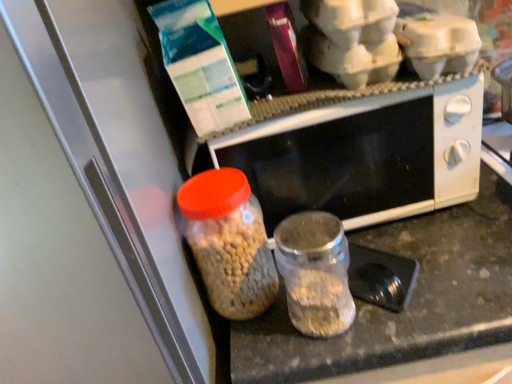
Question: In which direction should I rotate to look at transparent glass jar at center, acting as the first bottle starting from the right?

Choices:
 (A) right
 (B) left

Answer: (A)

Question: Is transparent glass jar at center, which is counted as the second bottle, starting from the left, oriented away from black matte microwave at center?

Choices:
 (A) yes
 (B) no

Answer: (A)

Question: Are transparent glass jar at center, which is counted as the second bottle, starting from the left, and black matte microwave at center far apart?

Choices:
 (A) no
 (B) yes

Answer: (A)

Question: Is transparent glass jar at center, which is counted as the second bottle, starting from the left, behind black matte microwave at center?

Choices:
 (A) no
 (B) yes

Answer: (A)

Question: Can you confirm if transparent glass jar at center, which is counted as the second bottle, starting from the left, is thinner than black matte microwave at center?

Choices:
 (A) no
 (B) yes

Answer: (B)

Question: Does transparent glass jar at center, which is counted as the second bottle, starting from the left, turn towards black matte microwave at center?

Choices:
 (A) no
 (B) yes

Answer: (A)

Question: Is transparent glass jar at center, acting as the first bottle starting from the right, shorter than black matte microwave at center?

Choices:
 (A) yes
 (B) no

Answer: (A)

Question: Considering the relative sizes of translucent glass jar at center, the second bottle from the right, and transparent glass jar at center, which is counted as the second bottle, starting from the left, in the image provided, is translucent glass jar at center, the second bottle from the right, wider than transparent glass jar at center, which is counted as the second bottle, starting from the left,?

Choices:
 (A) yes
 (B) no

Answer: (A)

Question: Is the depth of translucent glass jar at center, which ranks as the 1th bottle in left-to-right order, greater than that of transparent glass jar at center, acting as the first bottle starting from the right?

Choices:
 (A) no
 (B) yes

Answer: (B)

Question: Is translucent glass jar at center, which ranks as the 1th bottle in left-to-right order, positioned with its back to transparent glass jar at center, which is counted as the second bottle, starting from the left?

Choices:
 (A) yes
 (B) no

Answer: (B)

Question: Considering the relative sizes of translucent glass jar at center, which ranks as the 1th bottle in left-to-right order, and transparent glass jar at center, acting as the first bottle starting from the right, in the image provided, is translucent glass jar at center, which ranks as the 1th bottle in left-to-right order, thinner than transparent glass jar at center, acting as the first bottle starting from the right,?

Choices:
 (A) yes
 (B) no

Answer: (B)

Question: Is translucent glass jar at center, which ranks as the 1th bottle in left-to-right order, positioned far away from transparent glass jar at center, which is counted as the second bottle, starting from the left?

Choices:
 (A) yes
 (B) no

Answer: (B)

Question: Is transparent glass jar at center, which is counted as the second bottle, starting from the left, inside translucent glass jar at center, the second bottle from the right?

Choices:
 (A) yes
 (B) no

Answer: (B)

Question: Can you confirm if black matte microwave at center is thinner than transparent glass jar at center, which is counted as the second bottle, starting from the left?

Choices:
 (A) no
 (B) yes

Answer: (A)